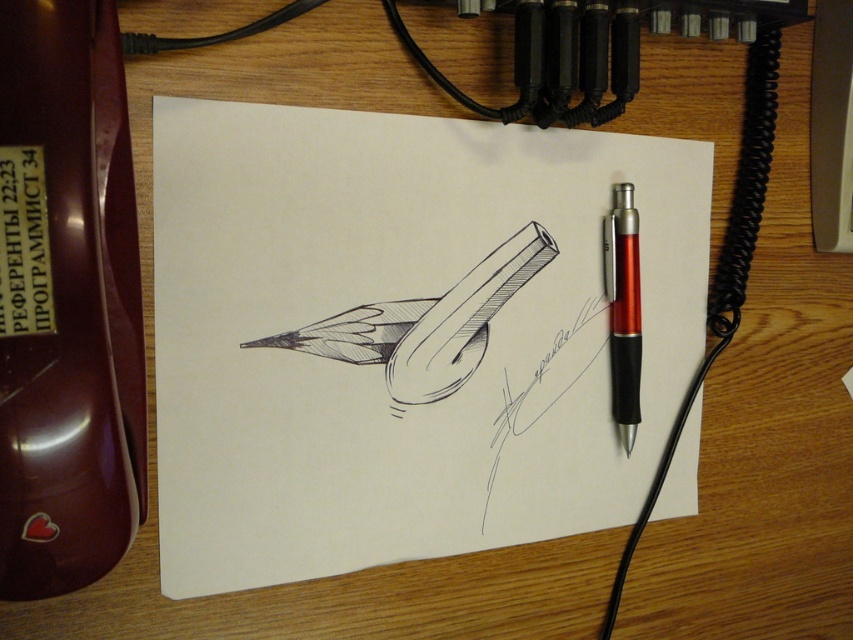
Question: Which point is closer to the camera?

Choices:
 (A) (280, 177)
 (B) (611, 323)

Answer: (A)

Question: In this image, where is white paper at center located relative to translucent red pen at right?

Choices:
 (A) below
 (B) above

Answer: (A)

Question: Does white paper at center lie behind translucent red pen at right?

Choices:
 (A) yes
 (B) no

Answer: (B)

Question: Which point is farther to the camera?

Choices:
 (A) translucent red pen at right
 (B) white paper at center

Answer: (A)

Question: Can you confirm if white paper at center is wider than translucent red pen at right?

Choices:
 (A) no
 (B) yes

Answer: (B)

Question: Among these objects, which one is farthest from the camera?

Choices:
 (A) translucent red pen at right
 (B) white paper at center

Answer: (A)